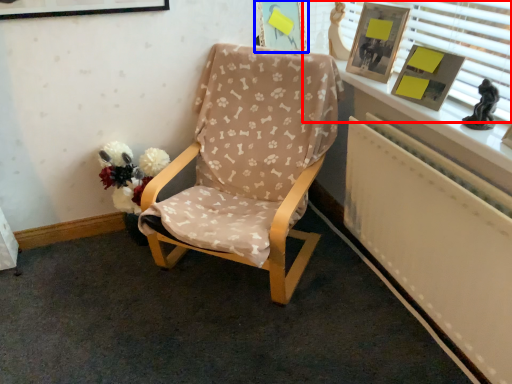
Question: Which of the following is the closest to the observer, window frame (highlighted by a red box) or picture frame (highlighted by a blue box)?

Choices:
 (A) window frame
 (B) picture frame

Answer: (A)